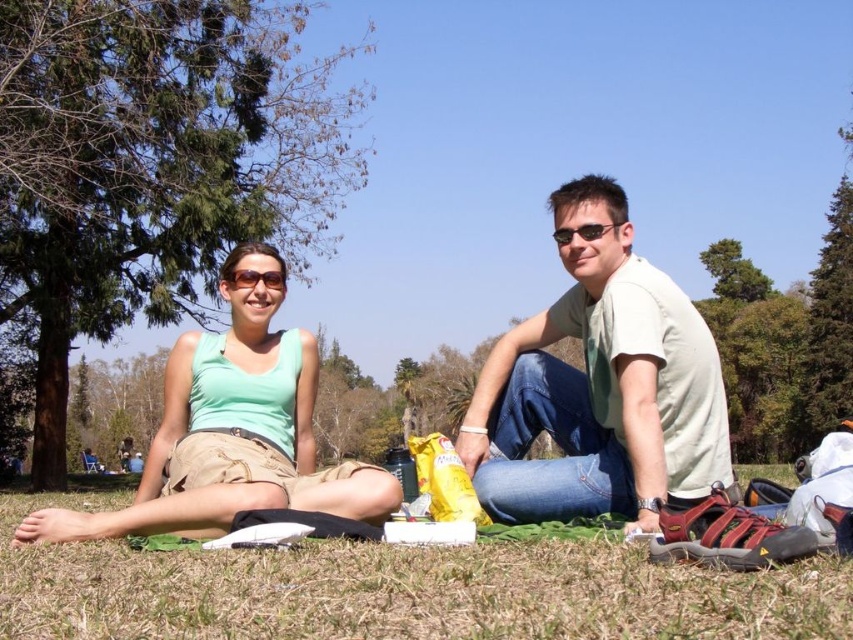
Question: Is green grass at lower center wider than light beige cotton shirt at center?

Choices:
 (A) yes
 (B) no

Answer: (A)

Question: Which point is farther to the camera?

Choices:
 (A) (288, 458)
 (B) (572, 465)
 (C) (653, 426)

Answer: (A)

Question: Is green fabric at center bigger than green matte tank top at center?

Choices:
 (A) yes
 (B) no

Answer: (A)

Question: Among these objects, which one is farthest from the camera?

Choices:
 (A) green fabric at center
 (B) light beige cotton shirt at center

Answer: (B)

Question: Which is farther from the green fabric at center?

Choices:
 (A) light beige cotton shirt at center
 (B) green grass at lower center
 (C) green matte tank top at center

Answer: (B)

Question: Is green grass at lower center bigger than green matte tank top at center?

Choices:
 (A) no
 (B) yes

Answer: (B)